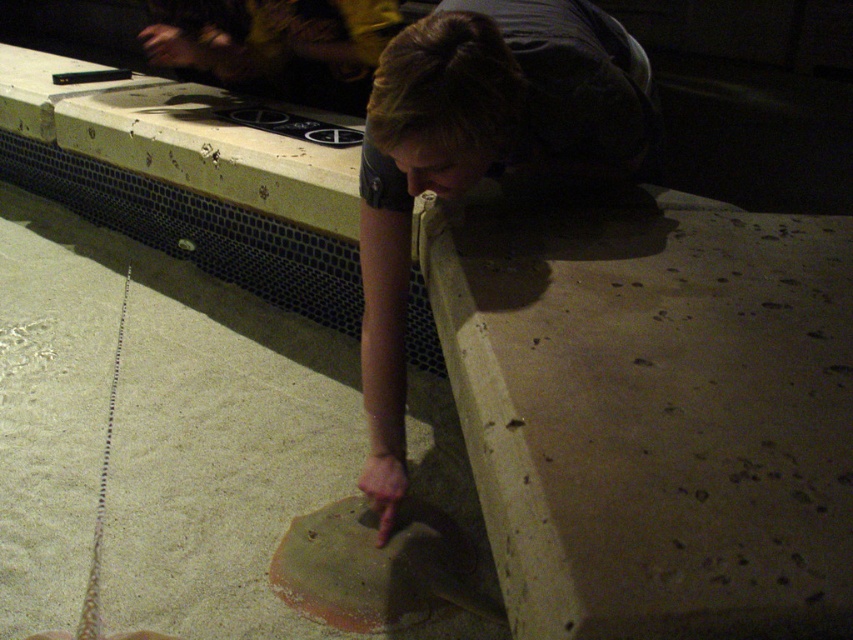
Question: Which object is the closest to the smooth concrete hand at lower center?

Choices:
 (A) smooth concrete at lower center
 (B) smooth concrete slab at lower right

Answer: (B)

Question: Which object appears closest to the camera in this image?

Choices:
 (A) smooth concrete hand at lower center
 (B) smooth concrete at lower center
 (C) smooth concrete slab at lower right

Answer: (C)

Question: Can you confirm if smooth concrete at lower center is bigger than smooth concrete hand at lower center?

Choices:
 (A) no
 (B) yes

Answer: (B)

Question: Does smooth concrete slab at lower right have a lesser width compared to smooth concrete at lower center?

Choices:
 (A) yes
 (B) no

Answer: (A)

Question: Does smooth concrete at lower center have a lesser width compared to smooth concrete hand at lower center?

Choices:
 (A) yes
 (B) no

Answer: (B)

Question: Considering the real-world distances, which object is closest to the smooth concrete hand at lower center?

Choices:
 (A) smooth concrete at lower center
 (B) smooth concrete slab at lower right

Answer: (B)